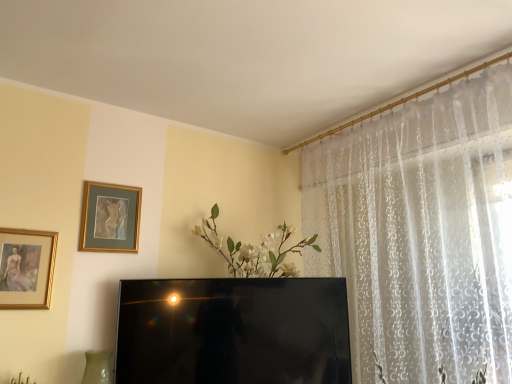
Question: Considering the relative sizes of gold-framed painting at upper left, which is counted as the first picture frame, starting from the right, and gold-framed painting at left, acting as the first picture frame starting from the left, in the image provided, is gold-framed painting at upper left, which is counted as the first picture frame, starting from the right, thinner than gold-framed painting at left, acting as the first picture frame starting from the left,?

Choices:
 (A) yes
 (B) no

Answer: (B)

Question: Is the position of gold-framed painting at upper left, the 2th picture frame from the front, more distant than that of gold-framed painting at left, which is the first picture frame in front-to-back order?

Choices:
 (A) yes
 (B) no

Answer: (A)

Question: From the image's perspective, does gold-framed painting at upper left, the 2th picture frame from the front, appear lower than gold-framed painting at left, marked as the 2th picture frame in a back-to-front arrangement?

Choices:
 (A) no
 (B) yes

Answer: (A)

Question: Is the position of gold-framed painting at upper left, marked as the 1th picture frame in a back-to-front arrangement, less distant than that of gold-framed painting at left, marked as the 2th picture frame in a back-to-front arrangement?

Choices:
 (A) yes
 (B) no

Answer: (B)

Question: Does gold-framed painting at upper left, the 2th picture frame from the front, turn towards gold-framed painting at left, which is the second picture frame in right-to-left order?

Choices:
 (A) no
 (B) yes

Answer: (A)

Question: Is gold-framed painting at upper left, marked as the 1th picture frame in a back-to-front arrangement, far away from gold-framed painting at left, which is the first picture frame in front-to-back order?

Choices:
 (A) no
 (B) yes

Answer: (A)

Question: Does black glossy television at center have a larger size compared to gold-framed painting at left, which is the first picture frame in front-to-back order?

Choices:
 (A) no
 (B) yes

Answer: (B)

Question: Does black glossy television at center have a greater width compared to gold-framed painting at left, marked as the 2th picture frame in a back-to-front arrangement?

Choices:
 (A) no
 (B) yes

Answer: (B)

Question: From a real-world perspective, is black glossy television at center physically below gold-framed painting at left, acting as the first picture frame starting from the left?

Choices:
 (A) yes
 (B) no

Answer: (A)

Question: From the image's perspective, is black glossy television at center below gold-framed painting at left, which is the second picture frame in right-to-left order?

Choices:
 (A) no
 (B) yes

Answer: (B)

Question: Can you confirm if black glossy television at center is thinner than gold-framed painting at left, marked as the 2th picture frame in a back-to-front arrangement?

Choices:
 (A) yes
 (B) no

Answer: (B)

Question: Can you confirm if black glossy television at center is smaller than gold-framed painting at left, which is the first picture frame in front-to-back order?

Choices:
 (A) yes
 (B) no

Answer: (B)

Question: Does gold-framed painting at left, marked as the 2th picture frame in a back-to-front arrangement, appear on the right side of black glossy television at center?

Choices:
 (A) no
 (B) yes

Answer: (A)